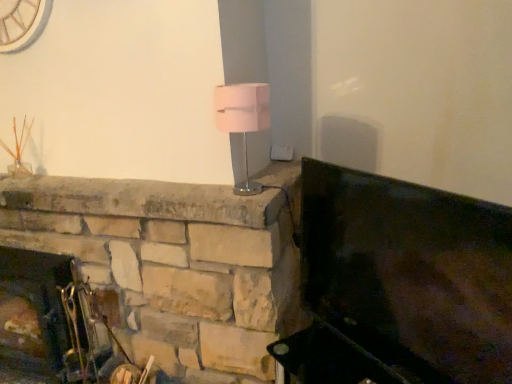
Question: Is pink fabric lampshade at center in contact with metallic dark green fireplace at right?

Choices:
 (A) no
 (B) yes

Answer: (A)

Question: Can you confirm if pink fabric lampshade at center is positioned to the right of metallic dark green fireplace at right?

Choices:
 (A) no
 (B) yes

Answer: (A)

Question: Does pink fabric lampshade at center come behind metallic dark green fireplace at right?

Choices:
 (A) no
 (B) yes

Answer: (B)

Question: Is pink fabric lampshade at center outside metallic dark green fireplace at right?

Choices:
 (A) yes
 (B) no

Answer: (A)

Question: Does pink fabric lampshade at center have a smaller size compared to metallic dark green fireplace at right?

Choices:
 (A) no
 (B) yes

Answer: (B)

Question: In terms of height, does metallic silver fireplace tools at lower left look taller or shorter compared to metallic dark green fireplace at right?

Choices:
 (A) short
 (B) tall

Answer: (B)

Question: In the image, is metallic silver fireplace tools at lower left on the left side or the right side of metallic dark green fireplace at right?

Choices:
 (A) left
 (B) right

Answer: (A)

Question: Which is correct: metallic silver fireplace tools at lower left is inside metallic dark green fireplace at right, or outside of it?

Choices:
 (A) inside
 (B) outside

Answer: (B)

Question: Considering their positions, is metallic silver fireplace tools at lower left located in front of or behind metallic dark green fireplace at right?

Choices:
 (A) front
 (B) behind

Answer: (B)

Question: In the image, is metallic silver fireplace tools at lower left positioned in front of or behind pink fabric lampshade at center?

Choices:
 (A) front
 (B) behind

Answer: (B)

Question: In the image, is metallic silver fireplace tools at lower left on the left side or the right side of pink fabric lampshade at center?

Choices:
 (A) left
 (B) right

Answer: (A)

Question: In terms of width, does metallic silver fireplace tools at lower left look wider or thinner when compared to pink fabric lampshade at center?

Choices:
 (A) wide
 (B) thin

Answer: (A)

Question: From a real-world perspective, is metallic silver fireplace tools at lower left physically located above or below pink fabric lampshade at center?

Choices:
 (A) above
 (B) below

Answer: (B)

Question: Is point (266, 110) positioned closer to the camera than point (45, 297)?

Choices:
 (A) farther
 (B) closer

Answer: (B)

Question: From the image's perspective, is pink fabric lampshade at center located above or below metallic silver fireplace tools at lower left?

Choices:
 (A) below
 (B) above

Answer: (B)